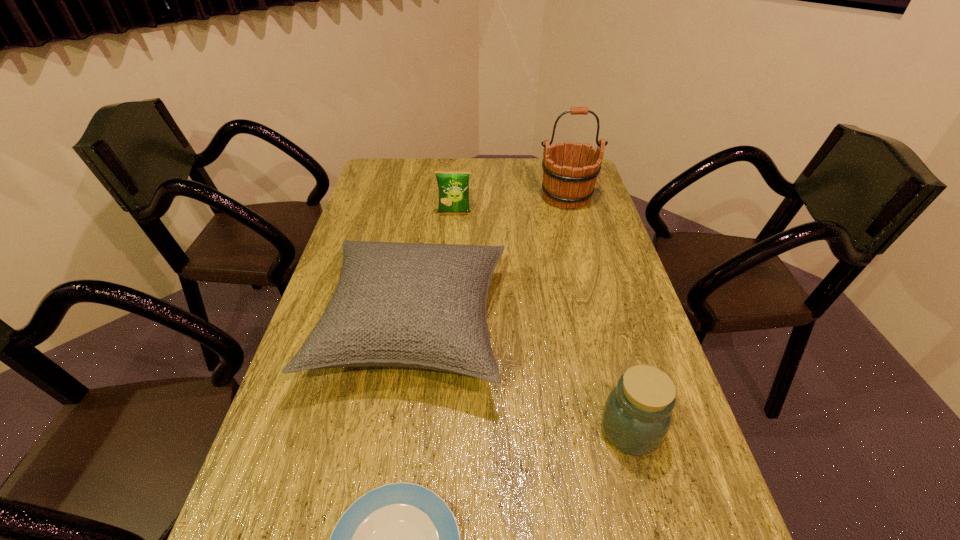
Locate an element on the screen. The height and width of the screenshot is (540, 960). wine bucket that is at the right edge is located at coordinates pos(562,185).

Identify the location of jar that is at the right edge. The width and height of the screenshot is (960, 540). (637, 415).

Locate an element on the screen. object positioned at the far right corner is located at coordinates (562, 185).

Where is `vacant space at the far edge of the desktop`? vacant space at the far edge of the desktop is located at coordinates (536, 158).

In the image, there is a desktop. In order to click on vacant space at the left edge in this screenshot , I will do `click(388, 193)`.

In order to click on free space at the right edge of the desktop in this screenshot , I will do `click(582, 264)`.

You are a GUI agent. You are given a task and a screenshot of the screen. Output one action in this format:
    pyautogui.click(x=<x>, y=<y>)
    Task: Click on the vacant point located between the jar and the wine bucket
    
    Given the screenshot: What is the action you would take?
    pyautogui.click(x=598, y=314)

This screenshot has width=960, height=540. I want to click on blank region between the crisp (potato chip) and the tallest object, so click(511, 205).

Where is `vacant area that lies between the jar and the wine bucket`? The height and width of the screenshot is (540, 960). vacant area that lies between the jar and the wine bucket is located at coordinates (598, 314).

What are the coordinates of `free space between the crisp (potato chip) and the wine bucket` in the screenshot? It's located at (511, 205).